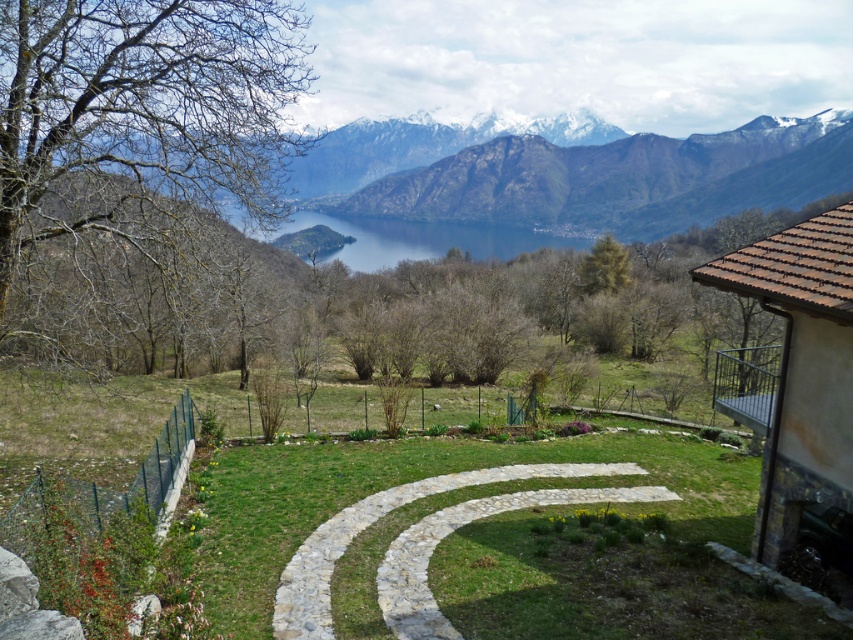
You are standing at the entrance of the cabin with a terracotta roof on the right side of the image. If you want to walk directly towards the snowy rock mountain at upper center, in which direction should you head?

The snowy rock mountain at upper center is located at point coordinates, so you should head towards the upper center direction from your current position at the cabin entrance.